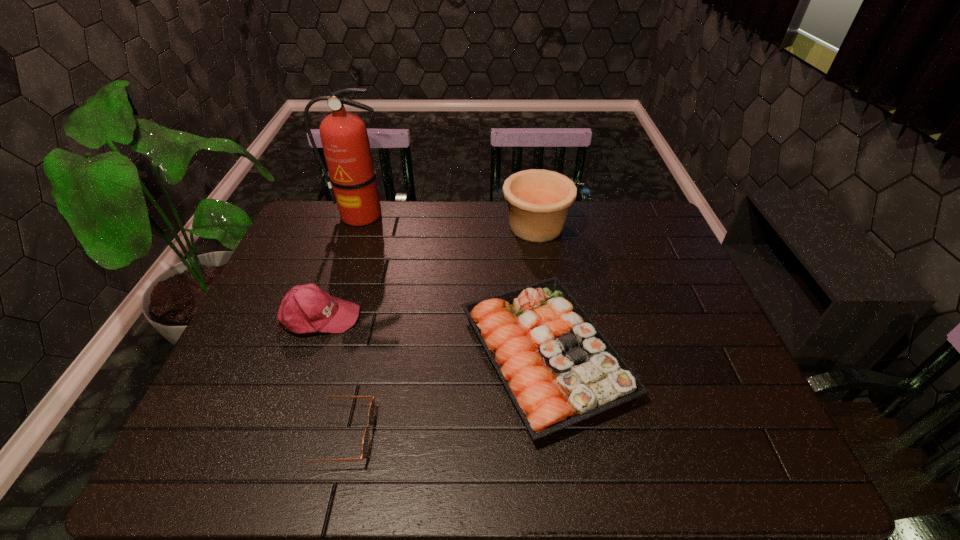
Locate an element on the screen. fire extinguisher that is at the far edge is located at coordinates (351, 179).

Locate an element on the screen. The width and height of the screenshot is (960, 540). pottery present at the far edge is located at coordinates (538, 200).

Identify the location of platter that is positioned at the near edge. (558, 368).

The height and width of the screenshot is (540, 960). Find the location of `sunglasses at the near edge`. sunglasses at the near edge is located at coordinates (371, 412).

This screenshot has width=960, height=540. Find the location of `fire extinguisher that is positioned at the left edge`. fire extinguisher that is positioned at the left edge is located at coordinates (351, 179).

Where is `baseball cap present at the left edge`? The height and width of the screenshot is (540, 960). baseball cap present at the left edge is located at coordinates (306, 308).

Image resolution: width=960 pixels, height=540 pixels. I want to click on object present at the far left corner, so click(351, 179).

In the image, there is a desktop. Where is `vacant space at the far edge`? vacant space at the far edge is located at coordinates (510, 240).

The image size is (960, 540). I want to click on vacant space at the near edge of the desktop, so click(x=489, y=451).

Find the location of a particular element. free space at the left edge is located at coordinates (235, 354).